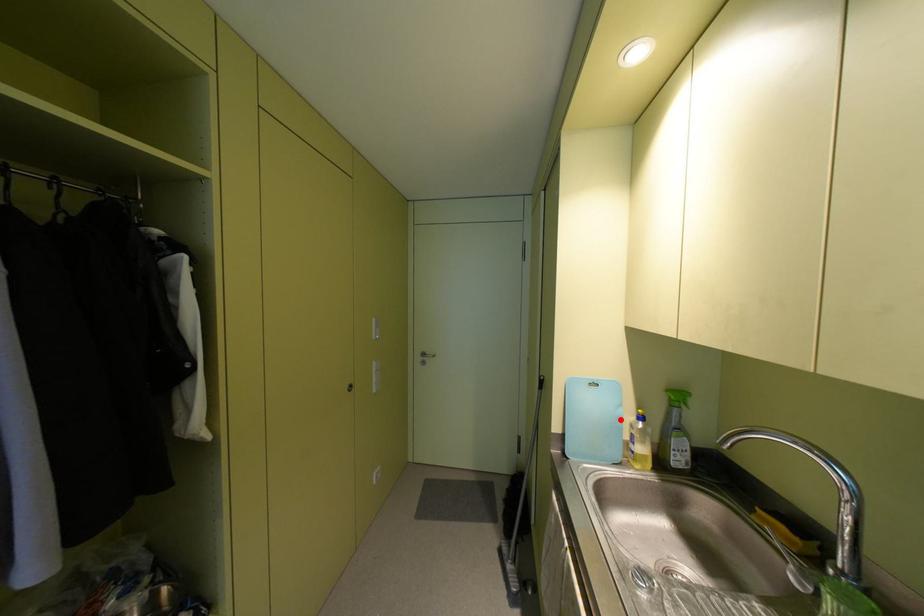
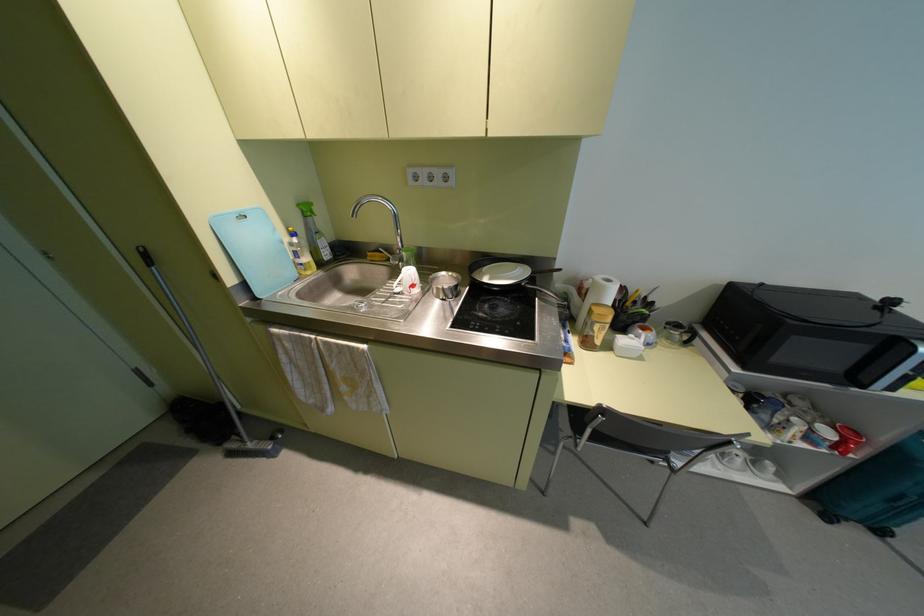
Question: I am providing you with two images of the same scene from different viewpoints. Given a red point in image1, look at the same physical point in image2. Is it:

Choices:
 (A) Closer to the viewpoint
 (B) Farther from the viewpoint

Answer: (A)